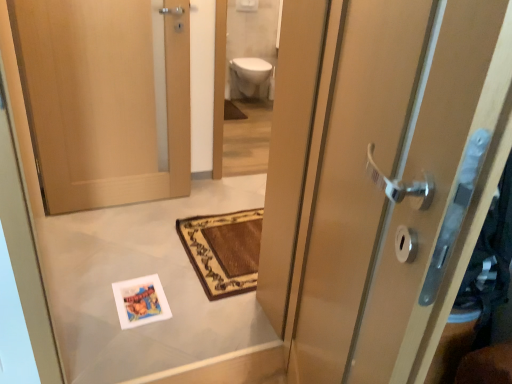
The height and width of the screenshot is (384, 512). What do you see at coordinates (232, 111) in the screenshot?
I see `brown woven bath mat at center` at bounding box center [232, 111].

The height and width of the screenshot is (384, 512). Find the location of `brown woven bath mat at center`. brown woven bath mat at center is located at coordinates (232, 111).

Would you say white glossy toilet at upper center is part of white glossy toilet bowl at upper center's contents?

No, white glossy toilet at upper center is not a part of white glossy toilet bowl at upper center.

Considering the relative sizes of white glossy toilet bowl at upper center and white glossy toilet at upper center in the image provided, is white glossy toilet bowl at upper center smaller than white glossy toilet at upper center?

Indeed, white glossy toilet bowl at upper center has a smaller size compared to white glossy toilet at upper center.

Is white glossy toilet bowl at upper center oriented towards white glossy toilet at upper center?

Yes, white glossy toilet bowl at upper center is aimed at white glossy toilet at upper center.

Looking at this image, considering the positions of objects matte wood door at right, the first door from the right, and white glossy toilet bowl at upper center in the image provided, who is in front, matte wood door at right, the first door from the right, or white glossy toilet bowl at upper center?

matte wood door at right, the first door from the right, is in front.

From the image's perspective, which door is the 2nd one below the white glossy toilet bowl at upper center? Please provide its 2D coordinates.

[(401, 180)]

Is white glossy toilet bowl at upper center inside matte wood door at right, marked as the second door in a back-to-front arrangement?

That's incorrect, white glossy toilet bowl at upper center is not inside matte wood door at right, marked as the second door in a back-to-front arrangement.

Which is more to the right, matte wood door at right, the 2th door when ordered from left to right, or white glossy toilet bowl at upper center?

matte wood door at right, the 2th door when ordered from left to right.

Is white glossy toilet at upper center placed right next to wooden door at left, the 1th door from the back?

There is a gap between white glossy toilet at upper center and wooden door at left, the 1th door from the back.

Which object is positioned more to the left, white glossy toilet at upper center or wooden door at left, the first door in the left-to-right sequence?

Positioned to the left is wooden door at left, the first door in the left-to-right sequence.

Can you confirm if white glossy toilet at upper center is smaller than wooden door at left, the first door in the left-to-right sequence?

A: Correct, white glossy toilet at upper center occupies less space than wooden door at left, the first door in the left-to-right sequence.

From a real-world perspective, is white glossy toilet at upper center on wooden door at left, the first door in the left-to-right sequence?

Correct, in the physical world, white glossy toilet at upper center is higher than wooden door at left, the first door in the left-to-right sequence.

You are a GUI agent. You are given a task and a screenshot of the screen. Output one action in this format:
    pyautogui.click(x=<x>, y=<y>)
    Task: Click on the mirror to the right of wooden door at left, the 1th door from the back
    
    Given the screenshot: What is the action you would take?
    pyautogui.click(x=246, y=84)

In the image, is wooden door at left, the 1th door from the back, positioned in front of or behind white glossy toilet at upper center?

Clearly, wooden door at left, the 1th door from the back, is in front of white glossy toilet at upper center.

Would you say wooden door at left, the 1th door from the back, is to the left or to the right of white glossy toilet at upper center in the picture?

wooden door at left, the 1th door from the back, is positioned on white glossy toilet at upper center's left side.

Is wooden door at left, the 1th door from the back, surrounding white glossy toilet at upper center?

Definitely not — white glossy toilet at upper center is not inside wooden door at left, the 1th door from the back.

Is point (228, 113) closer to camera compared to point (251, 63)?

Yes.

From a real-world perspective, which object rests below the other?

brown woven bath mat at center.

From the image's perspective, is brown woven bath mat at center beneath white glossy toilet bowl at upper center?

Yes, from the image's perspective, brown woven bath mat at center is below white glossy toilet bowl at upper center.

From a real-world perspective, is white glossy toilet bowl at upper center under brown woven bath mat at center?

No, from a real-world perspective, white glossy toilet bowl at upper center is not beneath brown woven bath mat at center.

Considering the sizes of objects white glossy toilet bowl at upper center and brown woven bath mat at center in the image provided, who is smaller, white glossy toilet bowl at upper center or brown woven bath mat at center?

Smaller between the two is brown woven bath mat at center.

Consider the image. Measure the distance from white glossy toilet bowl at upper center to brown woven bath mat at center.

white glossy toilet bowl at upper center is 16.57 inches away from brown woven bath mat at center.

Which of these two, white glossy toilet bowl at upper center or brown woven bath mat at center, is wider?

Wider between the two is white glossy toilet bowl at upper center.

From the picture: How distant is white glossy toilet bowl at upper center from matte wood door at right, the 2th door when ordered from left to right?

3.77 meters.

Is white glossy toilet bowl at upper center facing towards matte wood door at right, the 1th door when ordered from front to back?

Yes, white glossy toilet bowl at upper center is oriented towards matte wood door at right, the 1th door when ordered from front to back.

Is white glossy toilet bowl at upper center shorter than matte wood door at right, the first door from the right?

Yes.

Which object is positioned more to the right, white glossy toilet bowl at upper center or matte wood door at right, the 2th door when ordered from left to right?

matte wood door at right, the 2th door when ordered from left to right, is more to the right.

The height and width of the screenshot is (384, 512). In order to click on mirror below the white glossy toilet bowl at upper center (from the image's perspective) in this screenshot , I will do `click(246, 84)`.

From the white glossy toilet bowl at upper center, count 2nd doors forward and point to it. Please provide its 2D coordinates.

[(401, 180)]

Estimate the real-world distances between objects in this image. Which object is further from white glossy toilet bowl at upper center, white glossy toilet at upper center or matte wood door at right, the 1th door when ordered from front to back?

Based on the image, matte wood door at right, the 1th door when ordered from front to back, appears to be further to white glossy toilet bowl at upper center.

Based on the photo, when comparing their distances from wooden door at left, the first door in the left-to-right sequence, does matte wood door at right, marked as the second door in a back-to-front arrangement, or white glossy toilet bowl at upper center seem further?

white glossy toilet bowl at upper center is positioned further to the anchor wooden door at left, the first door in the left-to-right sequence.

From the image, which object appears to be nearer to white glossy toilet at upper center, white glossy toilet bowl at upper center or brown woven bath mat at center?

white glossy toilet bowl at upper center lies closer to white glossy toilet at upper center than the other object.

When comparing their distances from brown woven bath mat at center, does white glossy toilet at upper center or wooden door at left, which is the 2th door from right to left, seem further?

wooden door at left, which is the 2th door from right to left, is further to brown woven bath mat at center.

When comparing their distances from wooden door at left, which is the 2th door from right to left, does white glossy toilet at upper center or brown woven bath mat at center seem further?

brown woven bath mat at center is positioned further to the anchor wooden door at left, which is the 2th door from right to left.

Looking at the image, which one is located closer to white glossy toilet at upper center, brown woven bath mat at center or matte wood door at right, the 2th door when ordered from left to right?

brown woven bath mat at center is positioned closer to the anchor white glossy toilet at upper center.

Which object lies further to the anchor point matte wood door at right, marked as the second door in a back-to-front arrangement, white glossy toilet bowl at upper center or white glossy toilet at upper center?

Based on the image, white glossy toilet bowl at upper center appears to be further to matte wood door at right, marked as the second door in a back-to-front arrangement.

From the image, which object appears to be nearer to white glossy toilet bowl at upper center, wooden door at left, arranged as the 2th door when viewed from the front, or matte wood door at right, the first door from the right?

The object closer to white glossy toilet bowl at upper center is wooden door at left, arranged as the 2th door when viewed from the front.

You are a GUI agent. You are given a task and a screenshot of the screen. Output one action in this format:
    pyautogui.click(x=<x>, y=<y>)
    Task: Click on the bath mat between matte wood door at right, the first door from the right, and white glossy toilet bowl at upper center, along the z-axis
    The width and height of the screenshot is (512, 384).
    Given the screenshot: What is the action you would take?
    pyautogui.click(x=232, y=111)

At what (x,y) coordinates should I click in order to perform the action: click on bath mat between white glossy toilet at upper center and white glossy toilet bowl at upper center along the z-axis. Please return your answer as a coordinate pair (x, y). Looking at the image, I should click on (232, 111).

You are a GUI agent. You are given a task and a screenshot of the screen. Output one action in this format:
    pyautogui.click(x=<x>, y=<y>)
    Task: Click on the mirror positioned between wooden door at left, the first door in the left-to-right sequence, and brown woven bath mat at center from near to far
    The width and height of the screenshot is (512, 384).
    Given the screenshot: What is the action you would take?
    pyautogui.click(x=246, y=84)

Find the location of a particular element. The image size is (512, 384). door between matte wood door at right, the first door from the right, and white glossy toilet at upper center in the front-back direction is located at coordinates (105, 98).